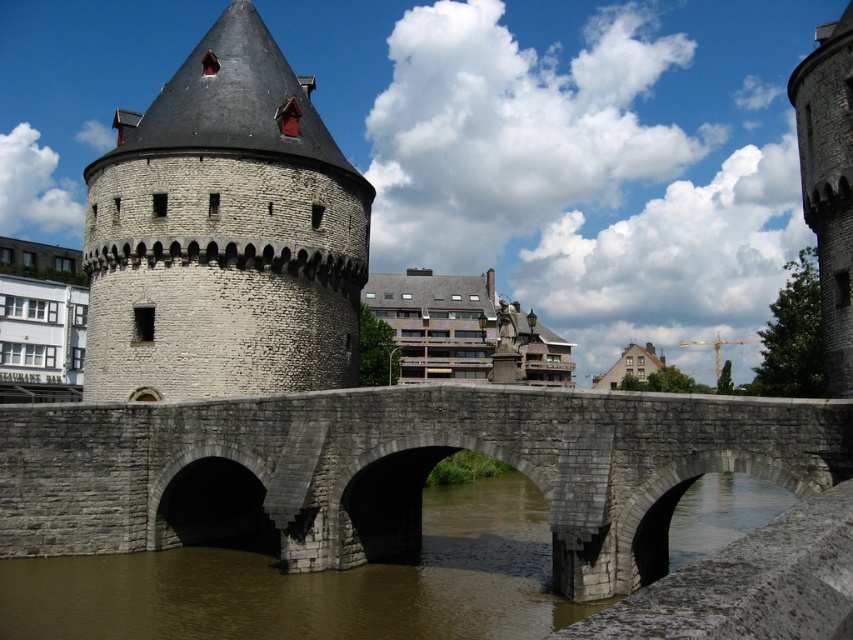
Question: Among these points, which one is farthest from the camera?

Choices:
 (A) (195, 45)
 (B) (844, 273)

Answer: (A)

Question: Which point appears closest to the camera in this image?

Choices:
 (A) (172, 164)
 (B) (578, 531)
 (C) (846, 74)

Answer: (B)

Question: Does gray stone tower at upper left appear over gray stone tower at right?

Choices:
 (A) yes
 (B) no

Answer: (B)

Question: Is gray stone bridge at center wider than gray stone tower at right?

Choices:
 (A) no
 (B) yes

Answer: (A)

Question: Which point appears closest to the camera in this image?

Choices:
 (A) (810, 202)
 (B) (38, 422)

Answer: (B)

Question: Can you confirm if gray stone tower at upper left is positioned below gray stone tower at right?

Choices:
 (A) no
 (B) yes

Answer: (B)